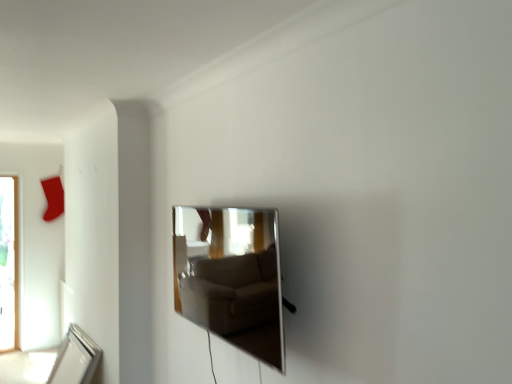
Question: In the image, is silver metallic mirror at lower left, the second mirror when ordered from right to left, positioned in front of or behind polished silver mirror at center, which is counted as the 1th mirror, starting from the front?

Choices:
 (A) front
 (B) behind

Answer: (B)

Question: Based on their sizes in the image, would you say silver metallic mirror at lower left, which is the first mirror from back to front, is bigger or smaller than polished silver mirror at center, which is counted as the 1th mirror, starting from the front?

Choices:
 (A) big
 (B) small

Answer: (A)

Question: Is point coord(98,350) positioned closer to the camera than point coord(187,264)?

Choices:
 (A) farther
 (B) closer

Answer: (A)

Question: Is polished silver mirror at center, which appears as the 2th mirror when ordered from the bottom, taller or shorter than silver metallic mirror at lower left, the 2th mirror viewed from the top?

Choices:
 (A) short
 (B) tall

Answer: (B)

Question: Based on their sizes in the image, would you say polished silver mirror at center, marked as the first mirror in a top-to-bottom arrangement, is bigger or smaller than silver metallic mirror at lower left, the 2th mirror viewed from the top?

Choices:
 (A) big
 (B) small

Answer: (B)

Question: Is point (270, 213) positioned closer to the camera than point (89, 382)?

Choices:
 (A) farther
 (B) closer

Answer: (B)

Question: Considering the relative positions of polished silver mirror at center, marked as the 2th mirror in a left-to-right arrangement, and silver metallic mirror at lower left, marked as the first mirror in a left-to-right arrangement, in the image provided, is polished silver mirror at center, marked as the 2th mirror in a left-to-right arrangement, to the left or to the right of silver metallic mirror at lower left, marked as the first mirror in a left-to-right arrangement,?

Choices:
 (A) right
 (B) left

Answer: (A)